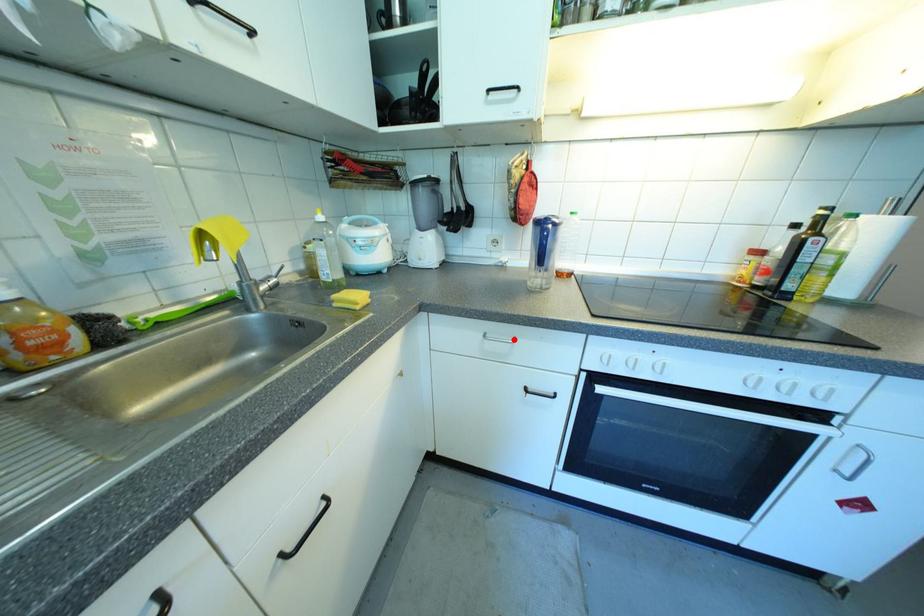
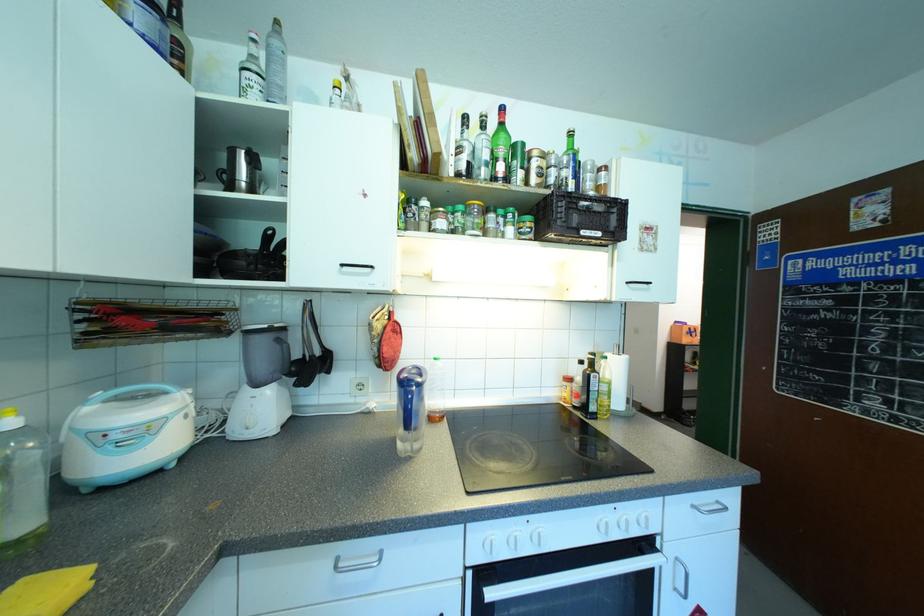
Where in the second image is the point corresponding to the highlighted location from the first image?

(380, 557)